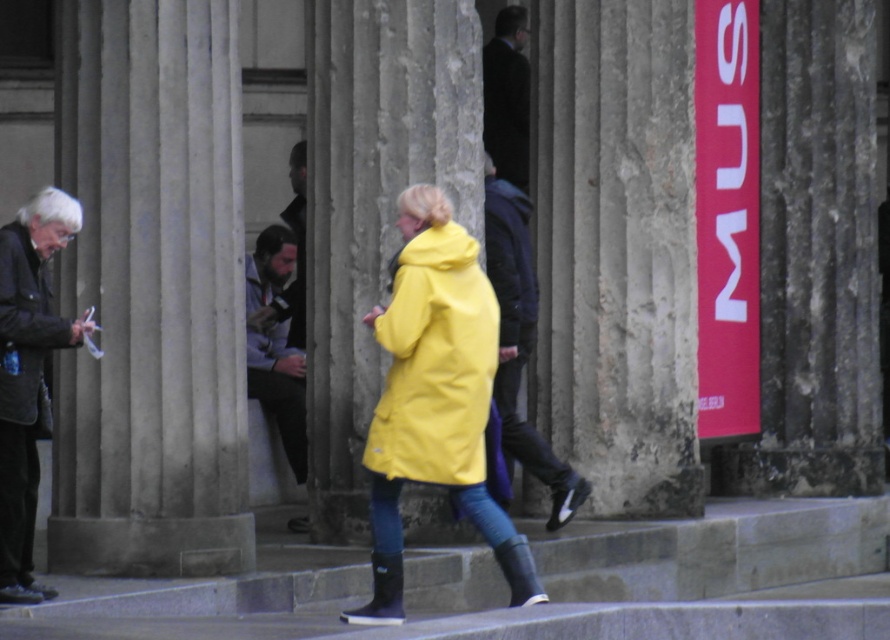
Question: Does dark blue leather jacket at center appear under matte black jacket at left?

Choices:
 (A) yes
 (B) no

Answer: (A)

Question: Is yellow matte coat at center above yellow matte jacket at center?

Choices:
 (A) yes
 (B) no

Answer: (B)

Question: Which of the following is the farthest from the observer?

Choices:
 (A) (31, 348)
 (B) (484, 264)
 (C) (397, 467)

Answer: (B)

Question: Which object appears closest to the camera in this image?

Choices:
 (A) dark blue leather jacket at center
 (B) smooth concrete pillar at left

Answer: (B)

Question: Does dark brown leather jacket at left appear under rubber boots at lower center?

Choices:
 (A) yes
 (B) no

Answer: (B)

Question: Which of the following is the closest to the observer?

Choices:
 (A) dark blue leather jacket at center
 (B) yellow matte jacket at center
 (C) rubber boots at lower center

Answer: (C)